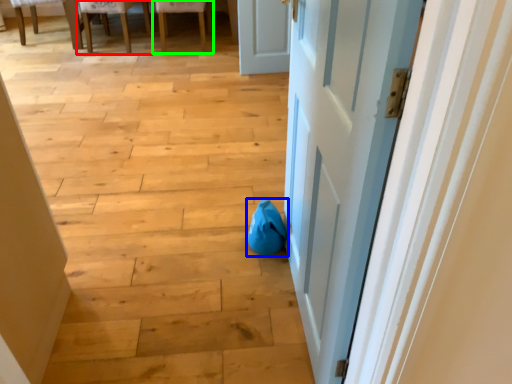
Question: Based on their relative distances, which object is nearer to chair (highlighted by a red box)? Choose from bean bag chair (highlighted by a blue box) and chair (highlighted by a green box).

Choices:
 (A) bean bag chair
 (B) chair

Answer: (B)